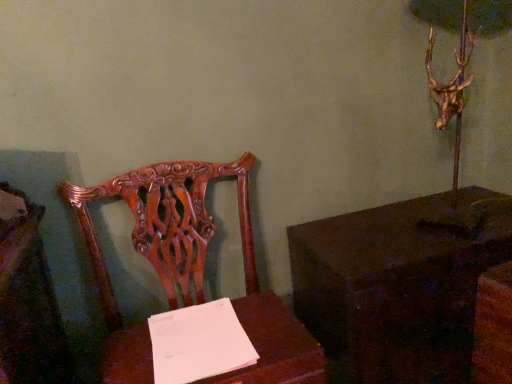
Question: From a real-world perspective, is polished wood chair at center under dark wood table at right, which is counted as the second table, starting from the left?

Choices:
 (A) no
 (B) yes

Answer: (A)

Question: From the image's perspective, is polished wood chair at center located beneath dark wood table at right, which is counted as the first table, starting from the right?

Choices:
 (A) yes
 (B) no

Answer: (B)

Question: Can you confirm if polished wood chair at center is thinner than dark wood table at right, which is counted as the second table, starting from the left?

Choices:
 (A) no
 (B) yes

Answer: (A)

Question: Is polished wood chair at center taller than dark wood table at right, which is counted as the second table, starting from the left?

Choices:
 (A) no
 (B) yes

Answer: (B)

Question: Is the depth of polished wood chair at center less than that of dark wood table at right, which is counted as the first table, starting from the right?

Choices:
 (A) no
 (B) yes

Answer: (B)

Question: In the image, is polished wood chair at center on the left side or the right side of wooden table at center, which is the first table from left to right?

Choices:
 (A) right
 (B) left

Answer: (B)

Question: Relative to wooden table at center, which is the first table from left to right, is polished wood chair at center in front or behind?

Choices:
 (A) behind
 (B) front

Answer: (B)

Question: From a real-world perspective, relative to wooden table at center, which is the first table from left to right, is polished wood chair at center vertically above or below?

Choices:
 (A) above
 (B) below

Answer: (B)

Question: Is polished wood chair at center situated inside wooden table at center, which ranks as the second table in right-to-left order, or outside?

Choices:
 (A) outside
 (B) inside

Answer: (A)

Question: Is point (348, 230) closer or farther from the camera than point (302, 379)?

Choices:
 (A) farther
 (B) closer

Answer: (A)

Question: Is dark wood table at right, which is counted as the second table, starting from the left, inside or outside of wooden table at center, which is the first table from left to right?

Choices:
 (A) outside
 (B) inside

Answer: (A)

Question: From their relative heights in the image, would you say dark wood table at right, which is counted as the second table, starting from the left, is taller or shorter than wooden table at center, which is the first table from left to right?

Choices:
 (A) short
 (B) tall

Answer: (B)

Question: Is dark wood table at right, which is counted as the second table, starting from the left, to the left or to the right of wooden table at center, which ranks as the second table in right-to-left order, in the image?

Choices:
 (A) right
 (B) left

Answer: (A)

Question: Is polished wood chair at center inside the boundaries of dark wood table at right, which is counted as the second table, starting from the left, or outside?

Choices:
 (A) outside
 (B) inside

Answer: (A)

Question: Would you say polished wood chair at center is to the left or to the right of dark wood table at right, which is counted as the second table, starting from the left, in the picture?

Choices:
 (A) left
 (B) right

Answer: (A)